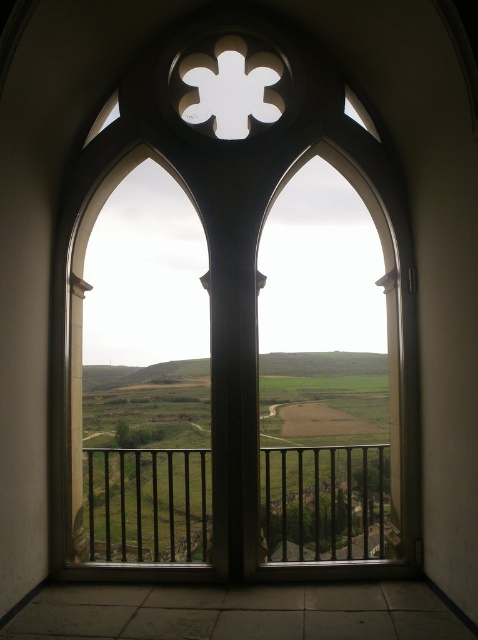
Between point (260, 138) and point (150, 522), which one is positioned behind?

The point (150, 522) is behind.

Is clear glass window at center further to the viewer compared to black metal railing at lower center?

No, clear glass window at center is closer to the viewer.

Describe the element at coordinates (235, 330) in the screenshot. Image resolution: width=478 pixels, height=640 pixels. I see `clear glass window at center` at that location.

This screenshot has width=478, height=640. What are the coordinates of `clear glass window at center` in the screenshot? It's located at (235, 330).